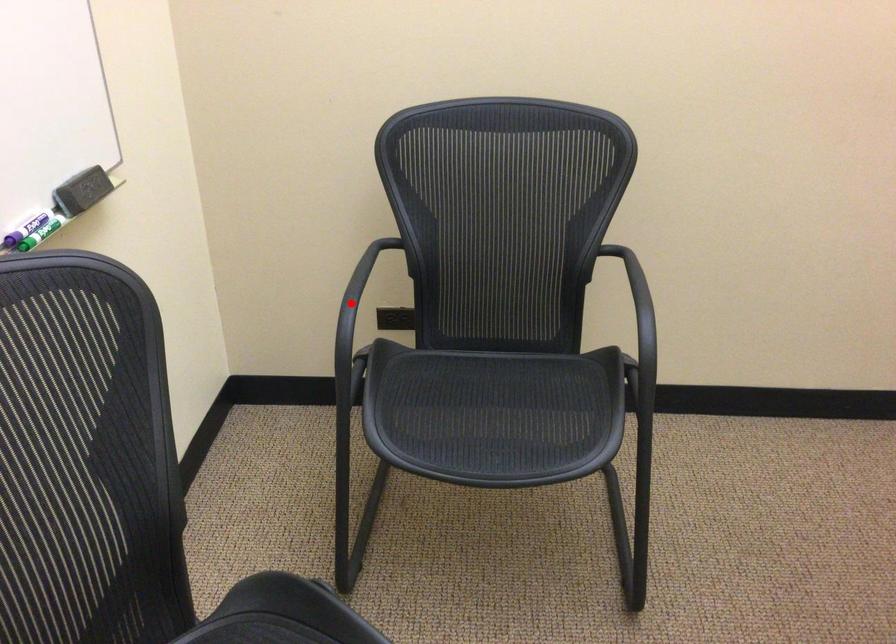
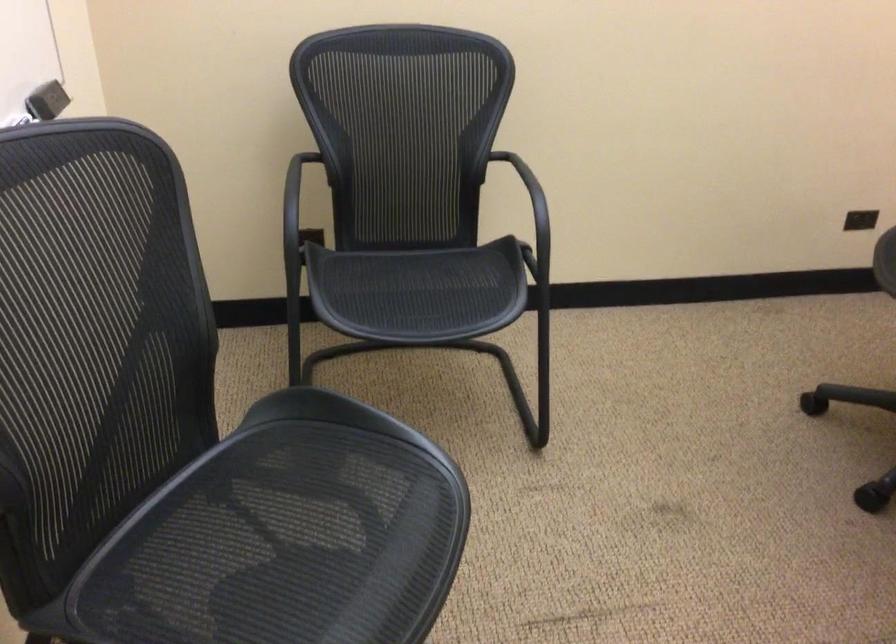
The point at the highlighted location is marked in the first image. Where is the corresponding point in the second image?

(298, 201)